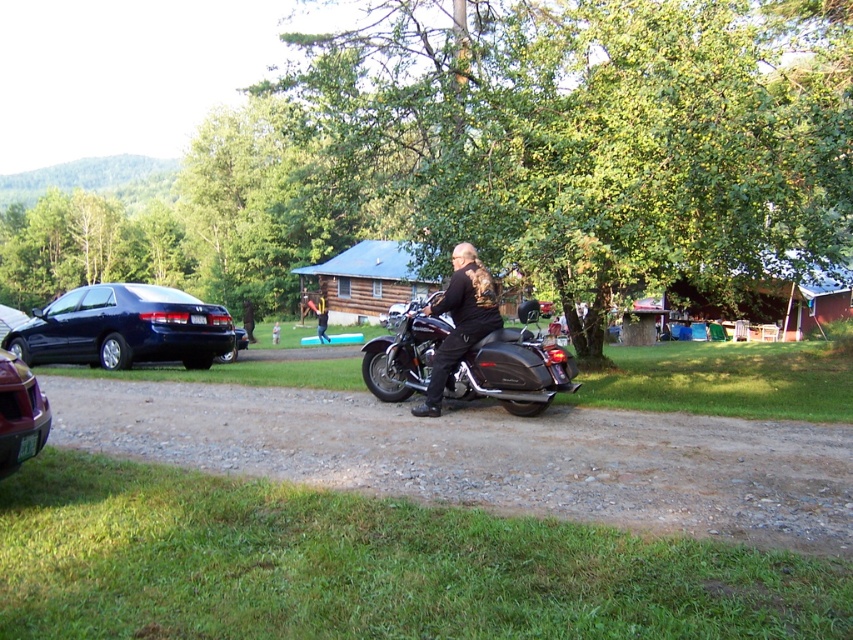
Is black matte motorcycle at center shorter than shiny blue sedan at left?

Yes.

Is point (550, 346) closer to camera compared to point (15, 320)?

Yes, it is.

Find the location of `black matte motorcycle at center`. black matte motorcycle at center is located at coordinates (514, 368).

Can you confirm if glossy blue sedan at left is positioned above shiny blue sedan at left?

Incorrect, glossy blue sedan at left is not positioned above shiny blue sedan at left.

Is glossy blue sedan at left positioned at the back of shiny blue sedan at left?

No, it is not.

The width and height of the screenshot is (853, 640). In order to click on glossy blue sedan at left in this screenshot , I will do `click(125, 328)`.

Does point (18, 438) lie in front of point (16, 324)?

Yes, point (18, 438) is closer to viewer.

Who is lower down, metallic maroon sedan at lower left or shiny blue sedan at left?

Positioned lower is metallic maroon sedan at lower left.

Where is `metallic maroon sedan at lower left`? metallic maroon sedan at lower left is located at coordinates (19, 413).

Identify the location of metallic maroon sedan at lower left. coord(19,413).